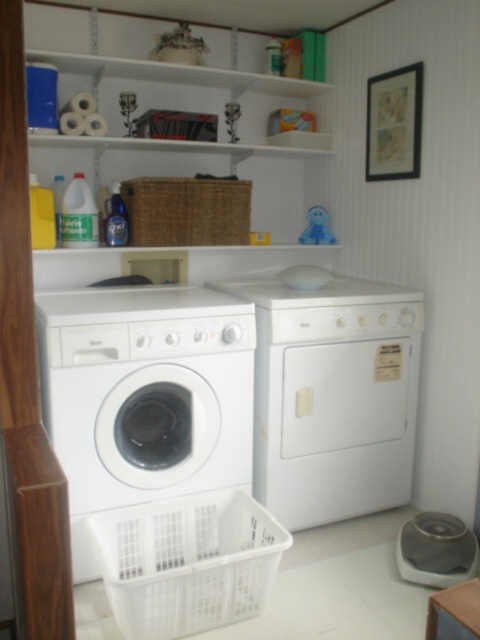
Does woven brown basket at upper center have a smaller size compared to white matte shelves at upper center?

Indeed, woven brown basket at upper center has a smaller size compared to white matte shelves at upper center.

Between point (219, 243) and point (302, 97), which one is positioned behind?

Point (302, 97)

Between point (224, 237) and point (62, 61), which one is positioned behind?

The point (224, 237) is behind.

Locate an element on the screen. Image resolution: width=480 pixels, height=640 pixels. woven brown basket at upper center is located at coordinates (188, 211).

Is white matte washing machine at center smaller than white plastic basket at lower center?

No.

Can you confirm if white matte washing machine at center is positioned below white plastic basket at lower center?

Actually, white matte washing machine at center is above white plastic basket at lower center.

Does point (70, 371) come in front of point (170, 627)?

That is False.

You are a GUI agent. You are given a task and a screenshot of the screen. Output one action in this format:
    pyautogui.click(x=<x>, y=<y>)
    Task: Click on the white matte washing machine at center
    
    Given the screenshot: What is the action you would take?
    pyautogui.click(x=144, y=396)

Which is below, white matte dryer at center or woven brown basket at upper center?

white matte dryer at center is below.

Is white matte dryer at center smaller than woven brown basket at upper center?

Incorrect, white matte dryer at center is not smaller in size than woven brown basket at upper center.

Identify the location of white matte dryer at center. This screenshot has height=640, width=480. coord(333,396).

At what (x,y) coordinates should I click in order to perform the action: click on white matte dryer at center. Please return your answer as a coordinate pair (x, y). The width and height of the screenshot is (480, 640). Looking at the image, I should click on (333, 396).